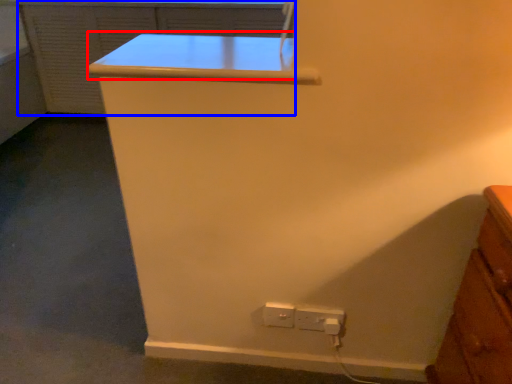
Question: Which object is further to the camera taking this photo, table (highlighted by a red box) or file cabinet (highlighted by a blue box)?

Choices:
 (A) table
 (B) file cabinet

Answer: (B)